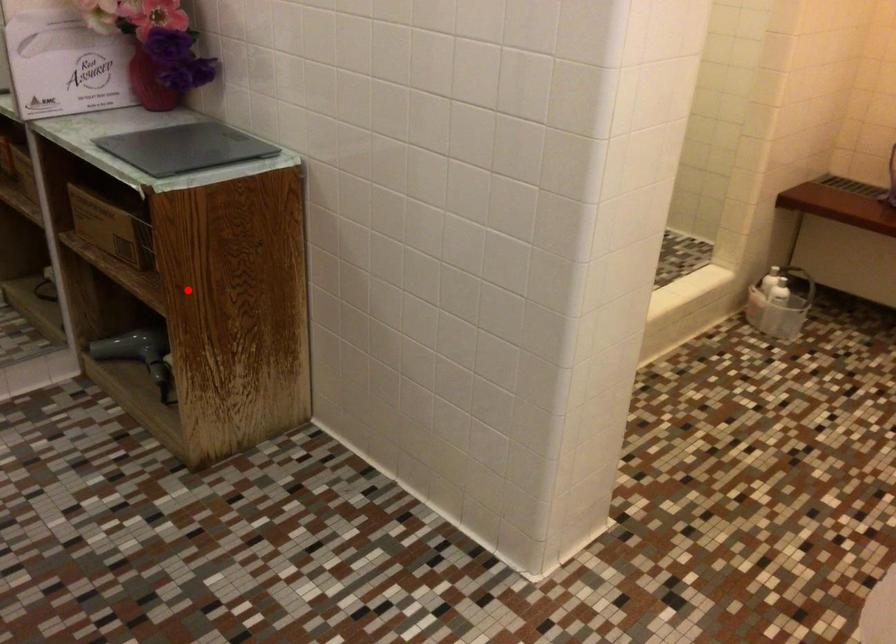
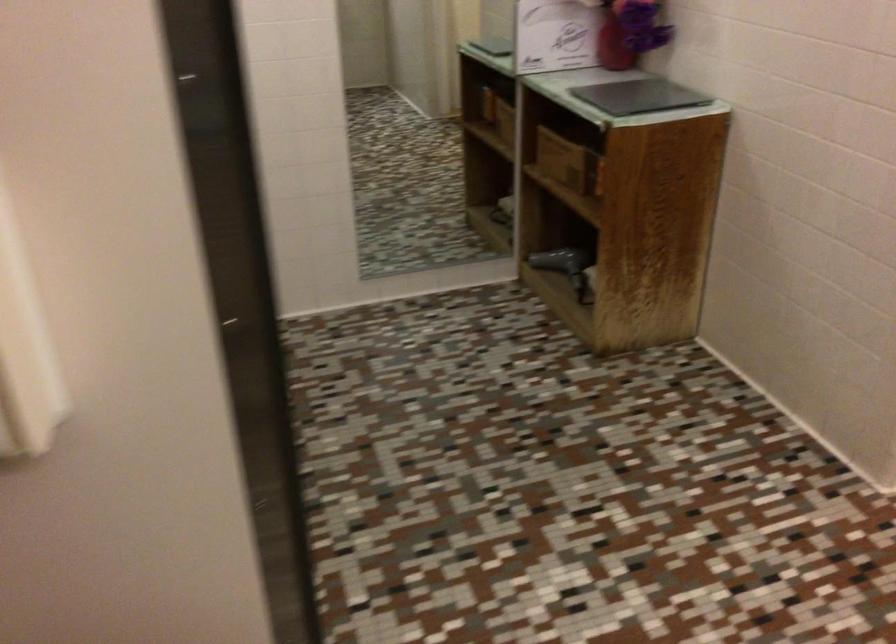
Question: I am providing you with two images of the same scene from different viewpoints. Given a red point in image1, look at the same physical point in image2. Is it:

Choices:
 (A) Closer to the viewpoint
 (B) Farther from the viewpoint

Answer: (B)